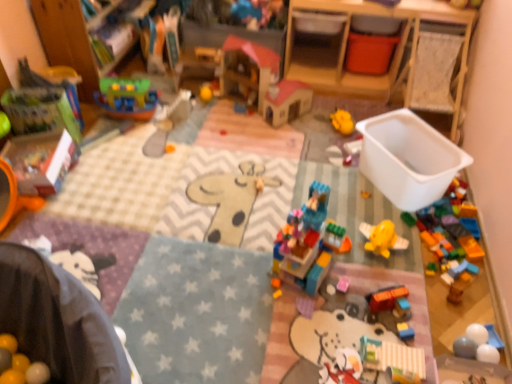
The image size is (512, 384). What are the coordinates of `vacant area that lies to the right of matte green book at left, acting as the 5th toy starting from the top` in the screenshot? It's located at (102, 135).